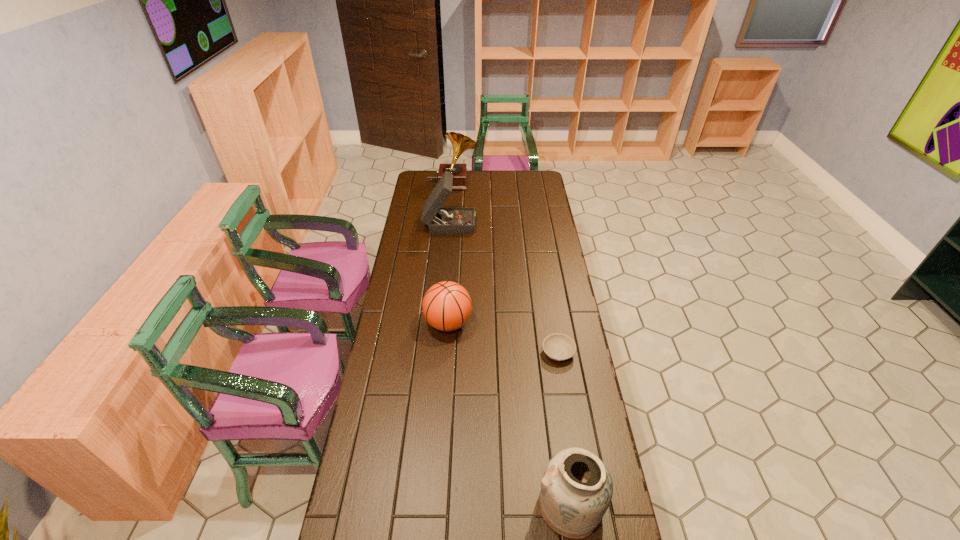
You are a GUI agent. You are given a task and a screenshot of the screen. Output one action in this format:
    pyautogui.click(x=<x>, y=<y>)
    Task: Click on the free space that satisfies the following two spatial constraints: 1. from the horn of the tallest object; 2. on the left side of the basketball
    
    Given the screenshot: What is the action you would take?
    pyautogui.click(x=441, y=323)